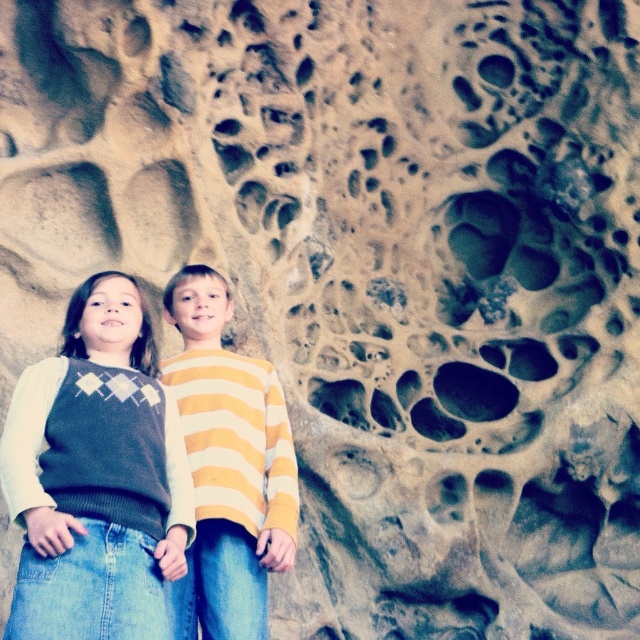
Question: Is knit sweater at center bigger than yellow striped sweater at center?

Choices:
 (A) no
 (B) yes

Answer: (A)

Question: Which object appears farthest from the camera in this image?

Choices:
 (A) yellow striped sweater at center
 (B) knit sweater at center

Answer: (A)

Question: Can you confirm if knit sweater at center is positioned to the left of yellow striped sweater at center?

Choices:
 (A) no
 (B) yes

Answer: (B)

Question: Can you confirm if knit sweater at center is thinner than yellow striped sweater at center?

Choices:
 (A) yes
 (B) no

Answer: (B)

Question: Among these objects, which one is farthest from the camera?

Choices:
 (A) knit sweater at center
 (B) yellow striped sweater at center

Answer: (B)